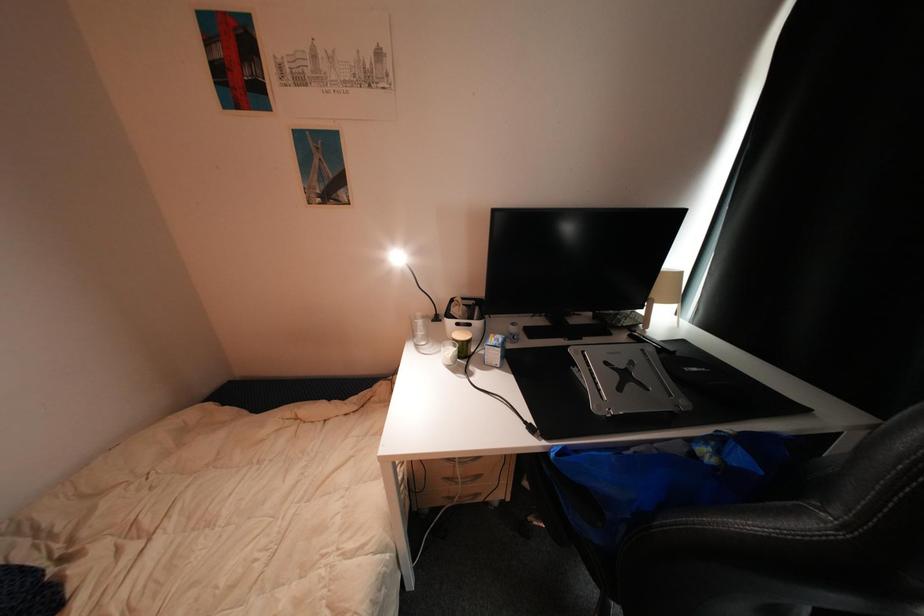
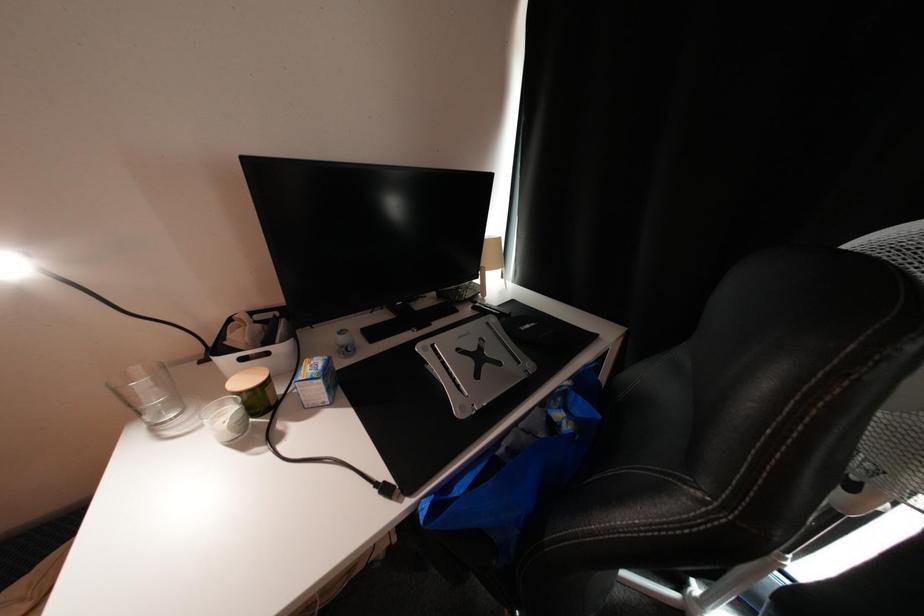
Question: How did the camera likely rotate?

Choices:
 (A) Left
 (B) Right
 (C) Up
 (D) Down

Answer: (B)